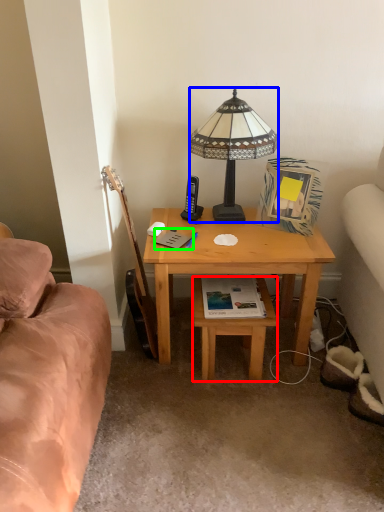
Question: Which object is the farthest from stool (highlighted by a red box)? Choose among these: lamp (highlighted by a blue box) or book (highlighted by a green box).

Choices:
 (A) lamp
 (B) book

Answer: (A)